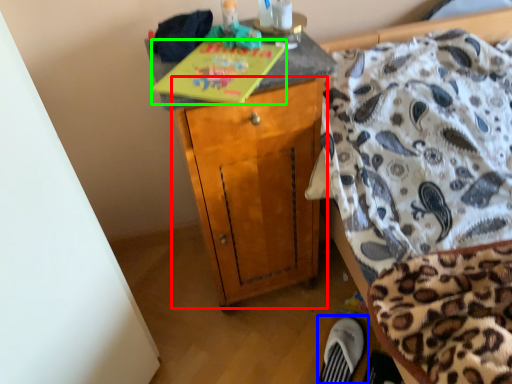
Question: Considering the real-world distances, which object is farthest from cabinetry (highlighted by a red box)? footwear (highlighted by a blue box) or book (highlighted by a green box)?

Choices:
 (A) footwear
 (B) book

Answer: (A)